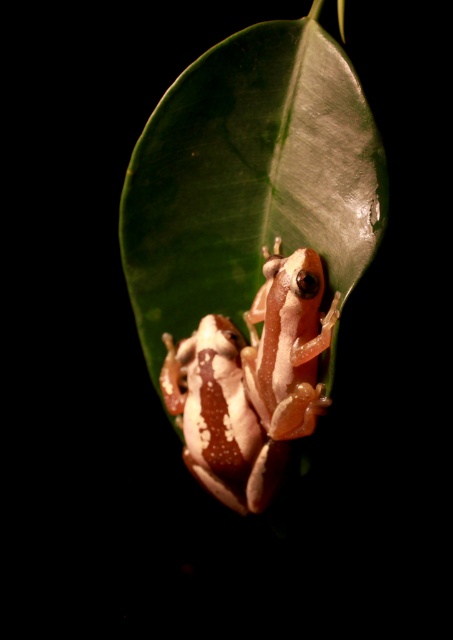
Question: Does translucent skin frog at center appear over speckled white frog at center?

Choices:
 (A) no
 (B) yes

Answer: (B)

Question: Considering the real-world distances, which object is closest to the translucent skin frog at center?

Choices:
 (A) speckled white frog at center
 (B) green glossy leaf at center

Answer: (A)

Question: Which object is positioned closest to the speckled white frog at center?

Choices:
 (A) translucent skin frog at center
 (B) green glossy leaf at center

Answer: (A)

Question: Can you confirm if translucent skin frog at center is wider than speckled white frog at center?

Choices:
 (A) yes
 (B) no

Answer: (B)

Question: Does green glossy leaf at center have a larger size compared to speckled white frog at center?

Choices:
 (A) yes
 (B) no

Answer: (A)

Question: Which object is positioned farthest from the green glossy leaf at center?

Choices:
 (A) translucent skin frog at center
 (B) speckled white frog at center

Answer: (B)